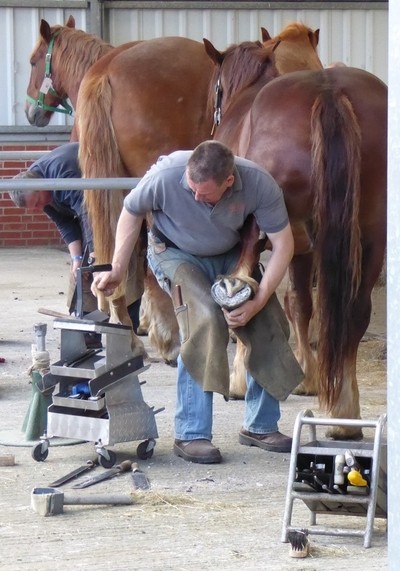
This screenshot has height=571, width=400. In order to click on brick wall in this screenshot , I will do (12, 228), (8, 164).